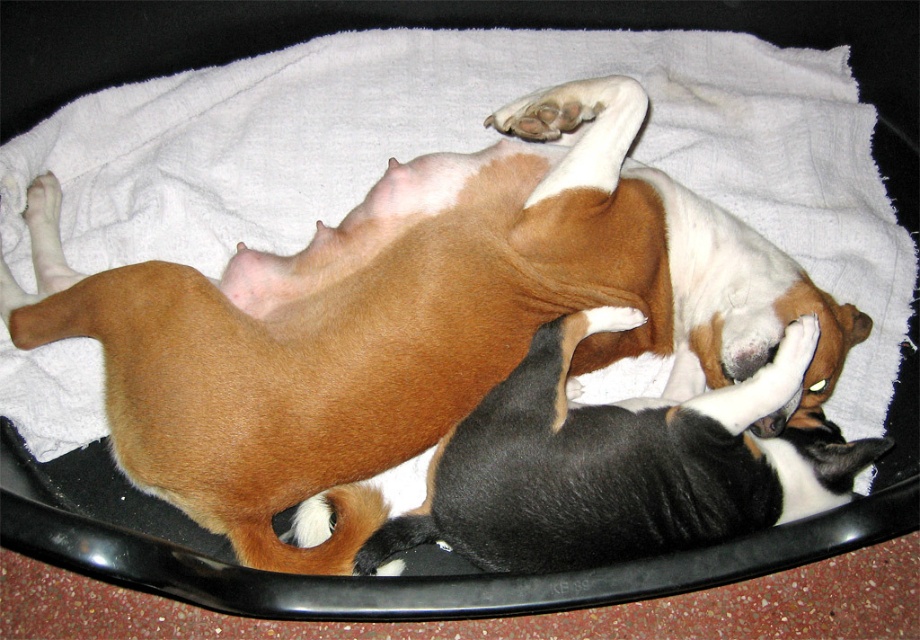
Is brown smooth dog at upper center below black and white fur at center?

Incorrect, brown smooth dog at upper center is not positioned below black and white fur at center.

Which of these two, brown smooth dog at upper center or black and white fur at center, stands taller?

brown smooth dog at upper center is taller.

Identify the location of brown smooth dog at upper center. The width and height of the screenshot is (920, 640). (414, 317).